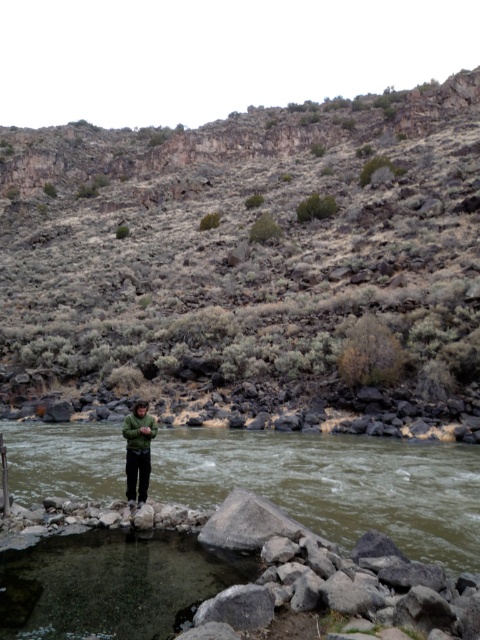
Question: Which object appears closest to the camera in this image?

Choices:
 (A) green matte jacket at center
 (B) brown rocky hillside at upper center
 (C) green fabric river at center

Answer: (C)

Question: Can you confirm if brown rocky hillside at upper center is bigger than green fabric river at center?

Choices:
 (A) yes
 (B) no

Answer: (A)

Question: From the image, what is the correct spatial relationship of green fabric river at center in relation to green matte jacket at center?

Choices:
 (A) right
 (B) left

Answer: (A)

Question: Does brown rocky hillside at upper center appear over green matte jacket at center?

Choices:
 (A) yes
 (B) no

Answer: (A)

Question: Which point is closer to the camera?

Choices:
 (A) (144, 476)
 (B) (477, 300)

Answer: (A)

Question: Which of the following is the closest to the observer?

Choices:
 (A) (477, 464)
 (B) (336, 413)
 (C) (134, 477)

Answer: (C)